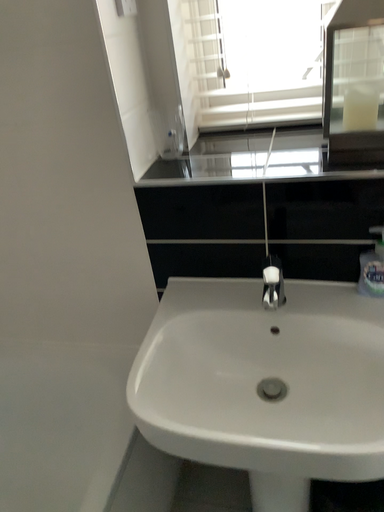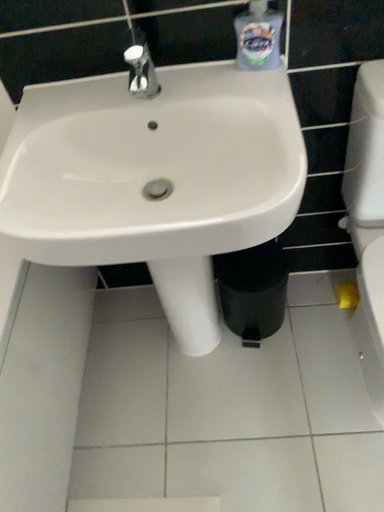
Question: Which way did the camera rotate in the video?

Choices:
 (A) rotated downward
 (B) rotated upward

Answer: (A)